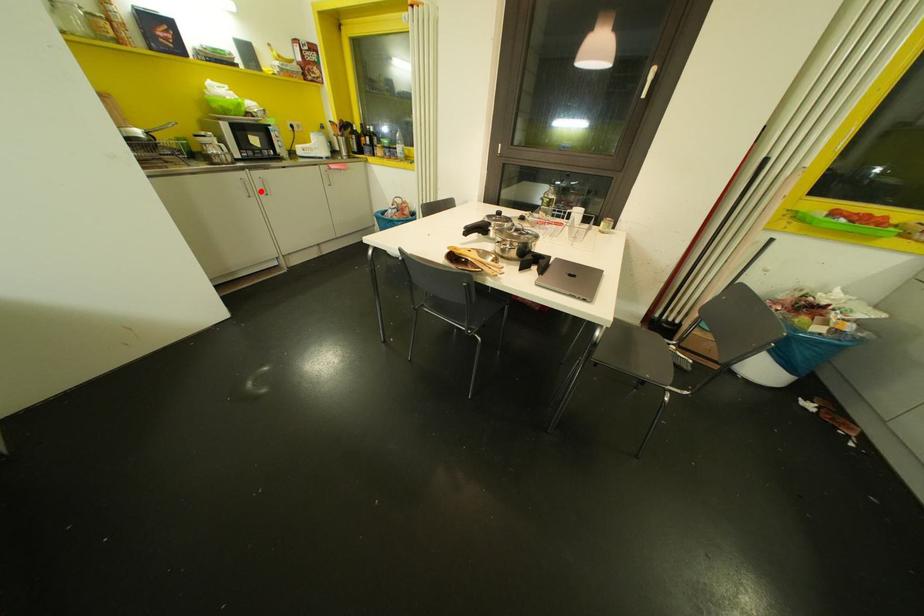
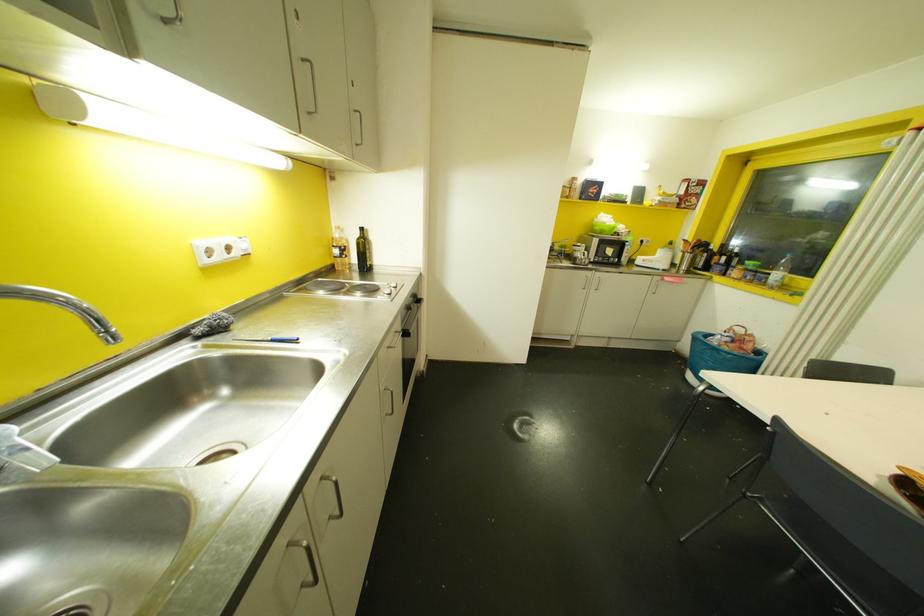
Question: I am providing you with two images of the same scene from different viewpoints. In image1, a red point is highlighted. Considering the same 3D point in image2, which of the following is correct?

Choices:
 (A) It is closer
 (B) It is farther

Answer: (B)